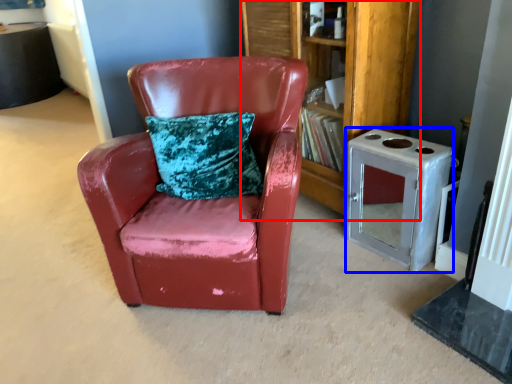
Question: Which of the following is the farthest to the observer, bookshelf (highlighted by a red box) or appliance (highlighted by a blue box)?

Choices:
 (A) bookshelf
 (B) appliance

Answer: (A)